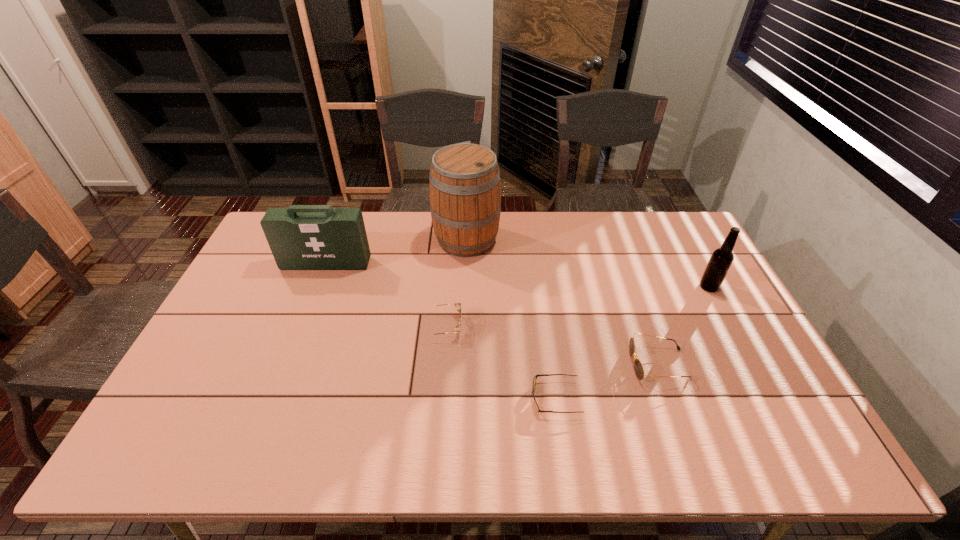
At what (x,y) coordinates should I click in order to perform the action: click on object located at the left edge. Please return your answer as a coordinate pair (x, y). The image size is (960, 540). Looking at the image, I should click on (301, 237).

The height and width of the screenshot is (540, 960). Find the location of `object located at the right edge`. object located at the right edge is located at coordinates (722, 258).

Where is `free space at the far edge of the desktop`? This screenshot has height=540, width=960. free space at the far edge of the desktop is located at coordinates (372, 213).

In order to click on vacant area at the near edge in this screenshot , I will do `click(647, 428)`.

In the image, there is a desktop. Find the location of `vacant area at the left edge`. vacant area at the left edge is located at coordinates (208, 405).

This screenshot has width=960, height=540. What are the coordinates of `vacant space at the right edge of the desktop` in the screenshot? It's located at (746, 356).

The height and width of the screenshot is (540, 960). What are the coordinates of `vacant region at the near left corner` in the screenshot? It's located at (158, 458).

Identify the location of free space at the far right corner. This screenshot has height=540, width=960. tap(695, 251).

This screenshot has height=540, width=960. I want to click on unoccupied position between the leftmost object and the fourth nearest object, so click(517, 275).

Find the location of a particular element. The image size is (960, 540). free spot between the farthest sunglasses and the rightmost sunglasses is located at coordinates (551, 345).